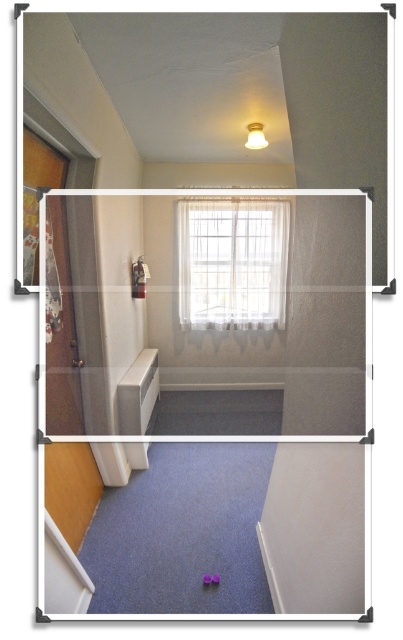
Question: Is the position of sheer white curtain at center less distant than that of purple rubber toy at lower center?

Choices:
 (A) yes
 (B) no

Answer: (B)

Question: Which point appears closest to the camera in this image?

Choices:
 (A) (259, 292)
 (B) (211, 579)
 (C) (207, 573)

Answer: (B)

Question: Which object is positioned closest to the purple rubber toy at lower center?

Choices:
 (A) matte purple toy at center
 (B) sheer white curtain at center

Answer: (A)

Question: Which of the following is the farthest from the observer?

Choices:
 (A) (207, 577)
 (B) (257, 284)

Answer: (B)

Question: Is matte purple toy at center smaller than purple rubber toy at lower center?

Choices:
 (A) yes
 (B) no

Answer: (B)

Question: Where is matte purple toy at center located in relation to purple rubber toy at lower center in the image?

Choices:
 (A) below
 (B) above

Answer: (A)